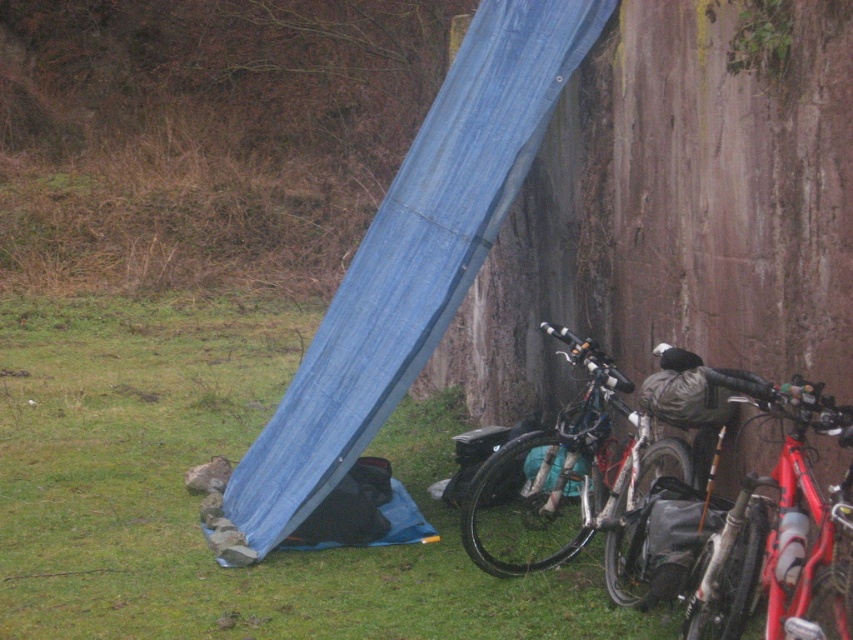
You are a hiker who just arrived at the camping site. You need to set up your tent but notice the blue tarp at lower left and the silver metallic bicycle at center. Which object is positioned higher from the ground?

The blue tarp at lower left is located above the silver metallic bicycle at center, so it is positioned higher from the ground.